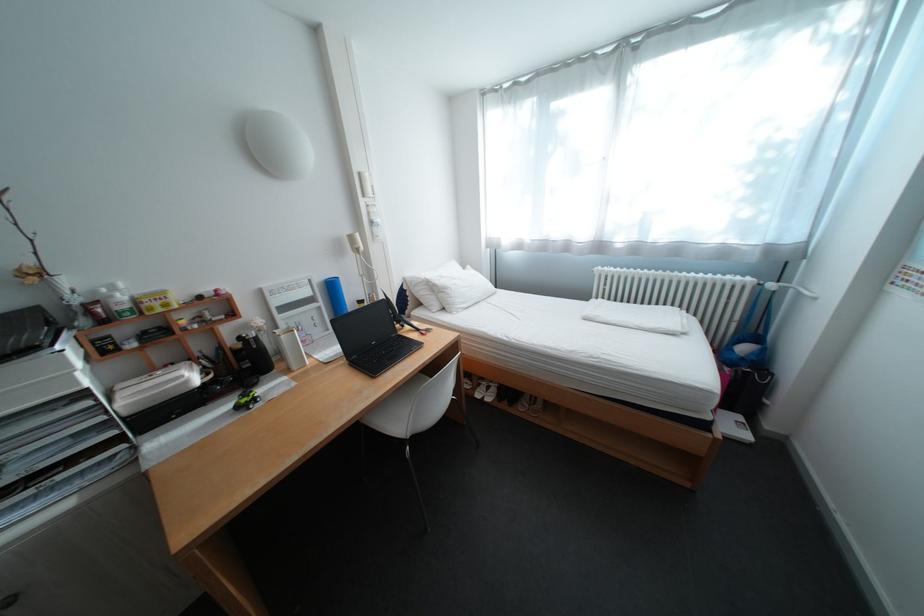
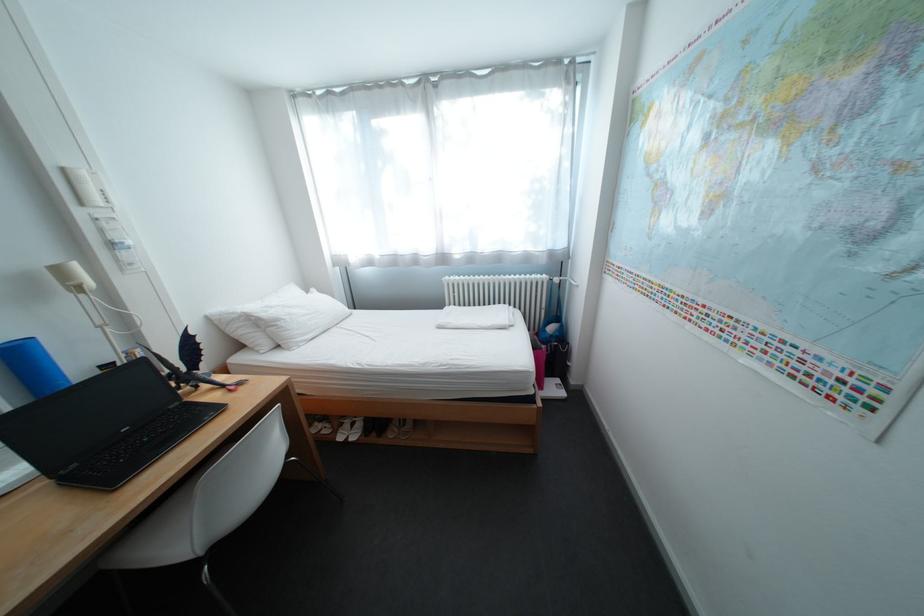
In the second image, find the point that corresponds to (x=363, y=238) in the first image.

(71, 272)